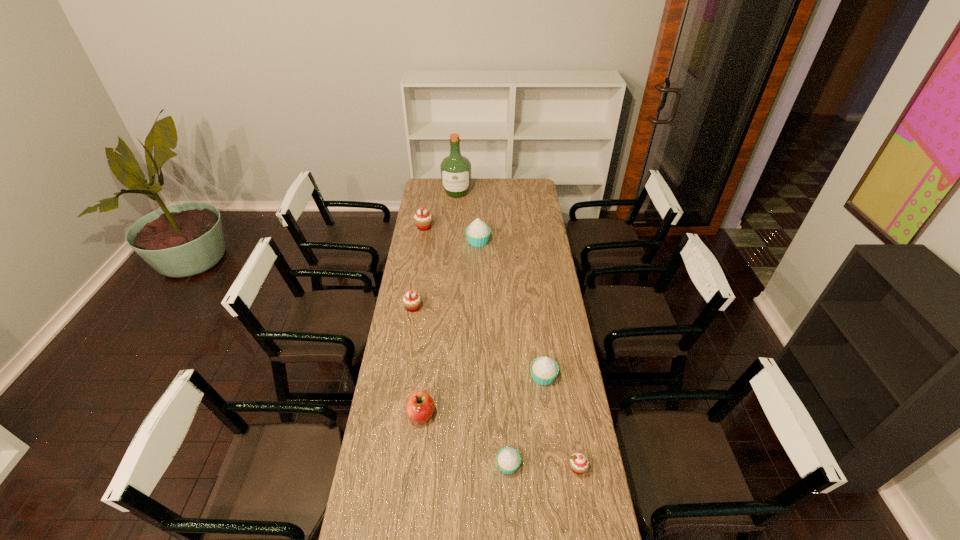
Find the location of a particular element. green liquor is located at coordinates (455, 169).

You are a GUI agent. You are given a task and a screenshot of the screen. Output one action in this format:
    pyautogui.click(x=<x>, y=<y>)
    Task: Click on the liquor
    The image size is (960, 540).
    Given the screenshot: What is the action you would take?
    pyautogui.click(x=455, y=169)

The image size is (960, 540). I want to click on the fifth nearest cupcake, so (477, 233).

Image resolution: width=960 pixels, height=540 pixels. In order to click on the farthest white cupcake in this screenshot , I will do `click(477, 233)`.

At what (x,y) coordinates should I click in order to perform the action: click on the farthest cupcake. Please return your answer as a coordinate pair (x, y). The image size is (960, 540). Looking at the image, I should click on (423, 219).

Find the location of a particular element. The width and height of the screenshot is (960, 540). the biggest pink cupcake is located at coordinates (423, 219).

Locate an element on the screen. Image resolution: width=960 pixels, height=540 pixels. the fourth farthest object is located at coordinates (411, 300).

Locate an element on the screen. Image resolution: width=960 pixels, height=540 pixels. the second biggest pink cupcake is located at coordinates (411, 300).

Locate an element on the screen. the rightmost white cupcake is located at coordinates (544, 370).

The width and height of the screenshot is (960, 540). I want to click on the fifth farthest object, so click(x=544, y=370).